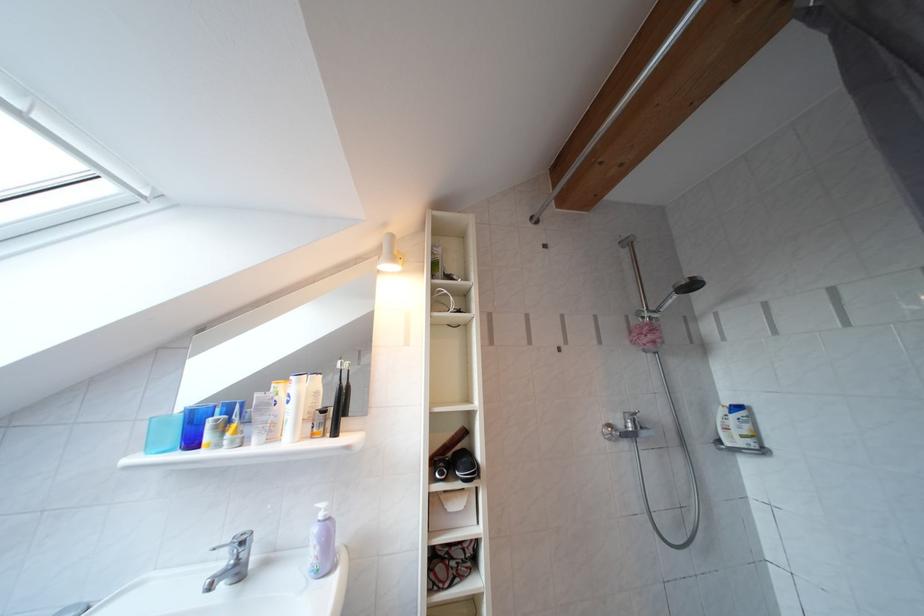
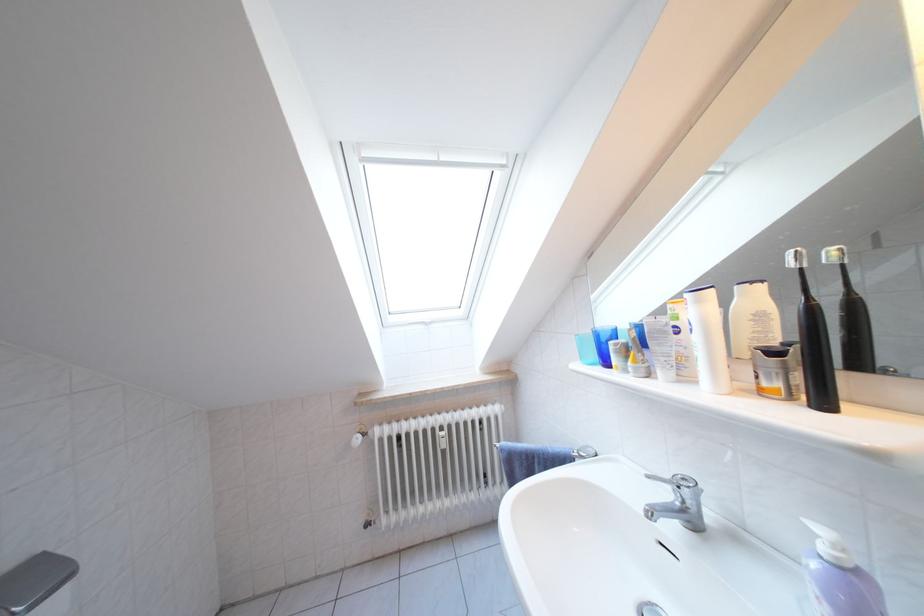
The point at (307, 387) is marked in the first image. Where is the corresponding point in the second image?

(708, 306)